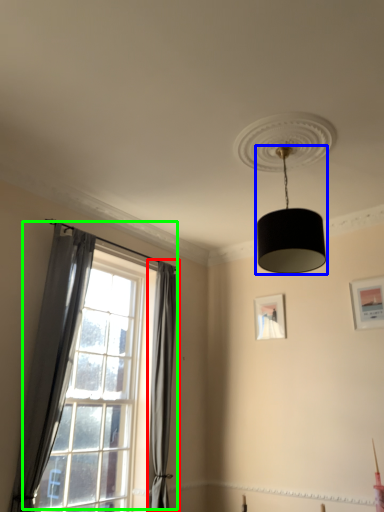
Question: Estimate the real-world distances between objects in this image. Which object is closer to curtain (highlighted by a red box), lamp (highlighted by a blue box) or window (highlighted by a green box)?

Choices:
 (A) lamp
 (B) window

Answer: (B)